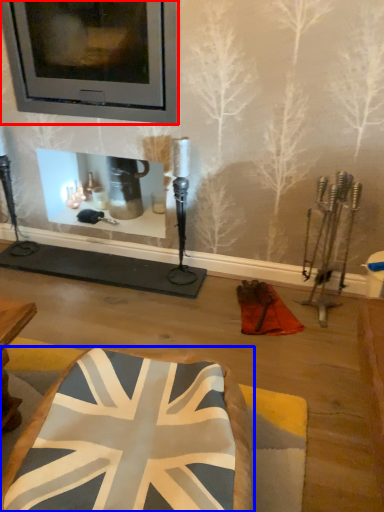
Question: Among these objects, which one is nearest to the camera, picture frame (highlighted by a red box) or furniture (highlighted by a blue box)?

Choices:
 (A) picture frame
 (B) furniture

Answer: (B)